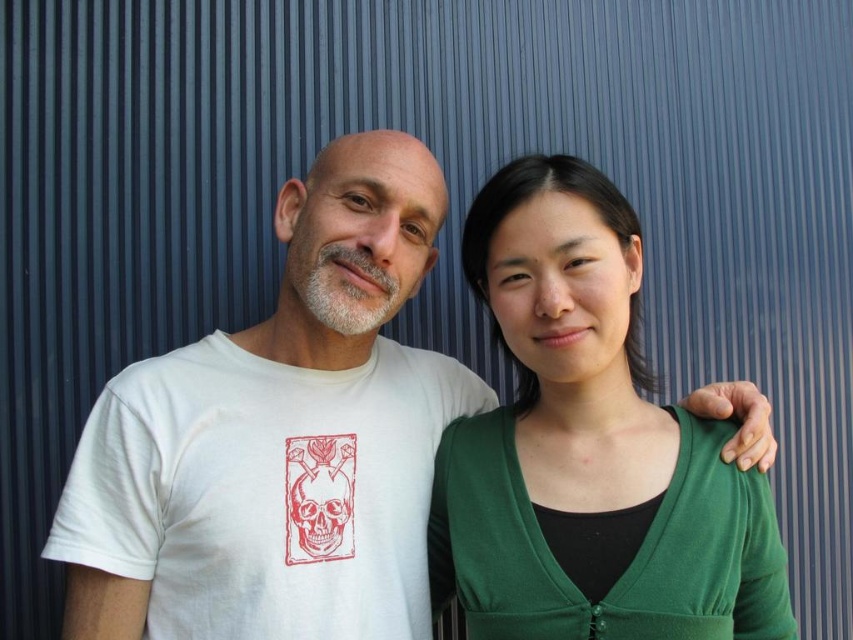
Between white matte t-shirt at left and white cotton t-shirt at left, which one appears on the left side from the viewer's perspective?

From the viewer's perspective, white cotton t-shirt at left appears more on the left side.

Find the location of a particular element. The image size is (853, 640). white matte t-shirt at left is located at coordinates (277, 436).

I want to click on white matte t-shirt at left, so click(x=277, y=436).

Is point (409, 150) farther from viewer compared to point (532, 356)?

That is True.

Does white matte t-shirt at left appear under green matte cardigan at right?

Incorrect, white matte t-shirt at left is not positioned below green matte cardigan at right.

Is point (318, 465) positioned before point (474, 566)?

No, (318, 465) is further to viewer.

The height and width of the screenshot is (640, 853). Identify the location of white matte t-shirt at left. (277, 436).

Does green matte cardigan at right appear on the left side of white cotton t-shirt at left?

Incorrect, green matte cardigan at right is not on the left side of white cotton t-shirt at left.

Locate an element on the screen. Image resolution: width=853 pixels, height=640 pixels. green matte cardigan at right is located at coordinates (589, 448).

Is point (544, 588) in front of point (426, 637)?

Yes, it is.

Locate an element on the screen. This screenshot has width=853, height=640. green matte cardigan at right is located at coordinates (589, 448).